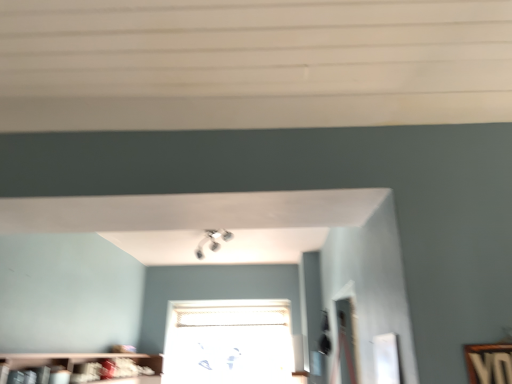
Question: Is transparent glass window at center oriented towards wooden bookshelf at lower left?

Choices:
 (A) yes
 (B) no

Answer: (A)

Question: Is transparent glass window at center shorter than wooden bookshelf at lower left?

Choices:
 (A) yes
 (B) no

Answer: (B)

Question: Considering the relative sizes of transparent glass window at center and wooden bookshelf at lower left in the image provided, is transparent glass window at center thinner than wooden bookshelf at lower left?

Choices:
 (A) yes
 (B) no

Answer: (A)

Question: Does transparent glass window at center come in front of wooden bookshelf at lower left?

Choices:
 (A) yes
 (B) no

Answer: (B)

Question: Is transparent glass window at center surrounding wooden bookshelf at lower left?

Choices:
 (A) no
 (B) yes

Answer: (A)

Question: Is transparent glass window at center looking in the opposite direction of wooden bookshelf at lower left?

Choices:
 (A) yes
 (B) no

Answer: (B)

Question: Is transparent glass window at center located within wooden bookshelf at lower left?

Choices:
 (A) yes
 (B) no

Answer: (B)

Question: From a real-world perspective, is wooden bookshelf at lower left positioned over transparent glass window at center based on gravity?

Choices:
 (A) yes
 (B) no

Answer: (B)

Question: Can you confirm if wooden bookshelf at lower left is smaller than transparent glass window at center?

Choices:
 (A) yes
 (B) no

Answer: (B)

Question: Can you confirm if wooden bookshelf at lower left is shorter than transparent glass window at center?

Choices:
 (A) yes
 (B) no

Answer: (A)

Question: Is wooden bookshelf at lower left facing away from transparent glass window at center?

Choices:
 (A) no
 (B) yes

Answer: (A)

Question: Can you confirm if wooden bookshelf at lower left is bigger than transparent glass window at center?

Choices:
 (A) no
 (B) yes

Answer: (B)

Question: Relative to wooden bookshelf at lower left, is transparent glass window at center in front or behind?

Choices:
 (A) front
 (B) behind

Answer: (B)